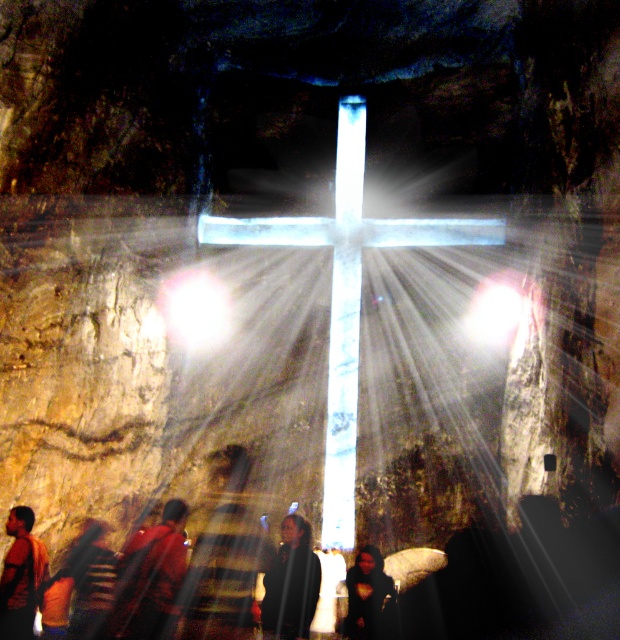
You are standing inside the cave looking at the glowing cross. There are two points marked in the image. The first point is at coordinates point [187,595] and the second point is at point [219,285]. Which of these points is nearer to you?

Point [187,595] is closer to the camera than point [219,285], so the first point is nearer to you.

You are an explorer in the cave and need to decide which item to use to shield yourself from the cross light. The dark brown leather jacket at lower left and the dark matte clothing at center are available. Which item is thinner and thus less effective at blocking the light?

The dark brown leather jacket at lower left is thinner than dark matte clothing at center, so it would be less effective at blocking the light.